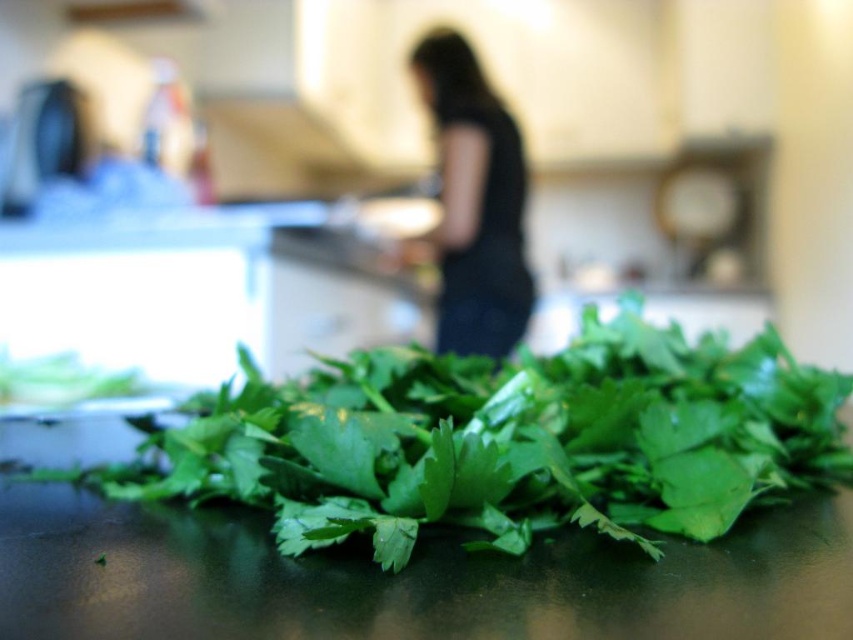
You are a chef standing in the kitchen and want to reach both the green leafy at center and the black fabric at center. Which one is closer to you?

The green leafy at center and the black fabric at center are both at center, but according to the description, the green leafy at center is 1.82 meters away from the black fabric at center. Since they are both at the center, their distance from you depends on your position. However, the description does not specify your exact location, so I cannot determine which is closer.

You are standing in a kitchen and see two points marked on the counter where fresh cilantro is scattered. The first point is at coordinates point (418, 348) and the second at point (444, 60). If you are facing the counter, which point is closer to you?

Point (418, 348) is in front of point (444, 60), so the first point is closer to you.

You are a chef preparing a dish and need to place both the green leafy at center and the black fabric at center on a small plate. Which object should you place first to ensure they both fit?

The green leafy at center might be wider than black fabric at center, so you should place the black fabric at center first to accommodate the wider green leafy at center.